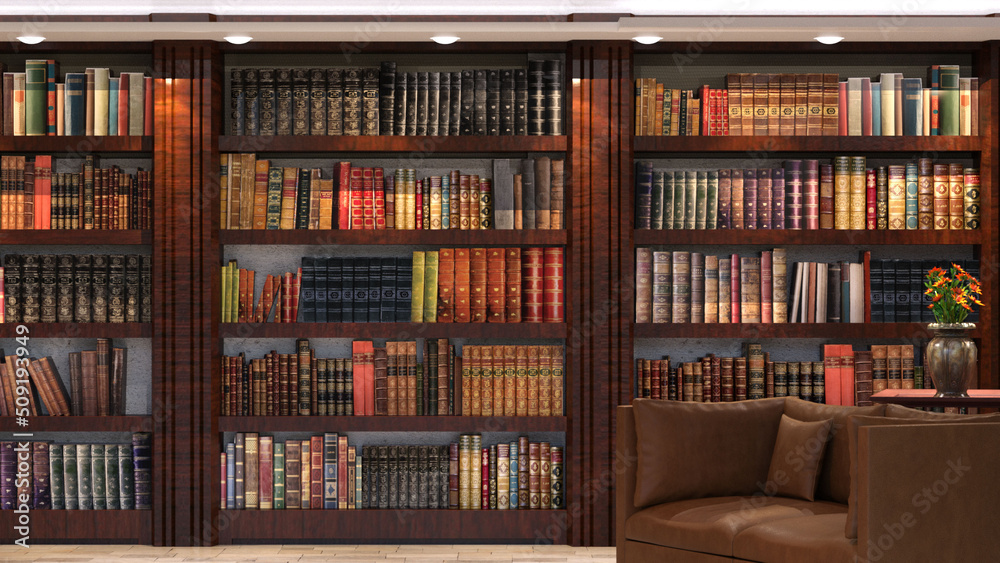
Locate an element on the screen. The width and height of the screenshot is (1000, 563). books on 3rd shelf of bookcase on left side is located at coordinates (148, 305), (135, 311), (113, 310), (96, 309), (80, 307), (64, 308), (47, 310), (32, 305), (12, 308).